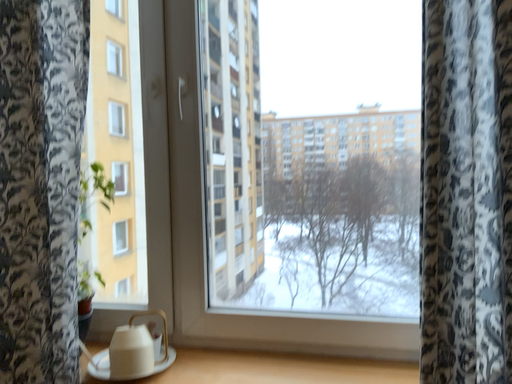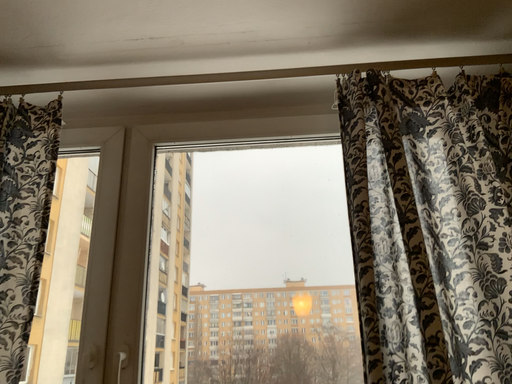
Question: How did the camera likely rotate when shooting the video?

Choices:
 (A) rotated left
 (B) rotated right

Answer: (B)